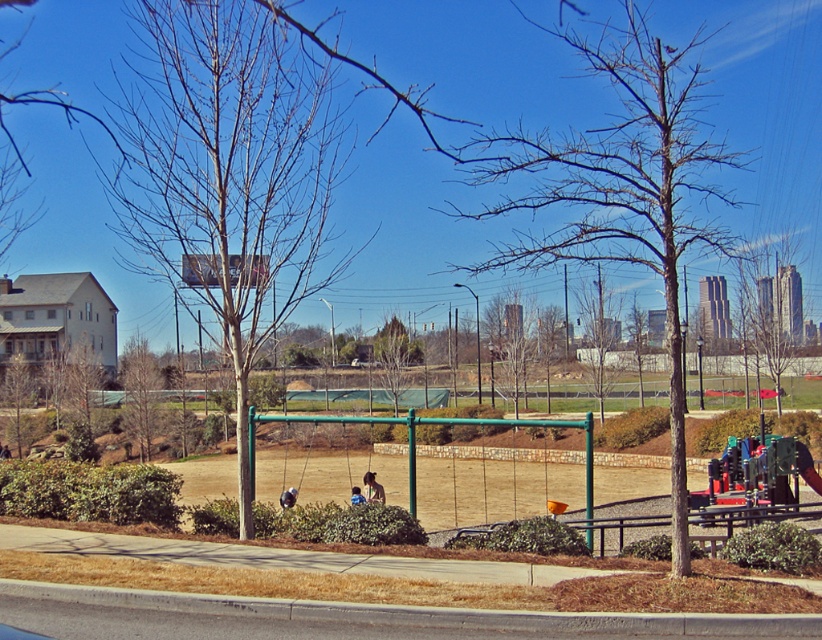
Question: Estimate the real-world distances between objects in this image. Which object is closer to the metallic silver swing at center?

Choices:
 (A) bare wood tree at center
 (B) brown/dry tree at left
 (C) blue denim jeans at lower center
 (D) dark brown leather jacket at lower center

Answer: (C)

Question: Which of the following is the closest to the observer?

Choices:
 (A) (5, 445)
 (B) (363, 499)
 (C) (284, 500)

Answer: (C)

Question: Is brown/dry tree at left smaller than blue denim jeans at lower center?

Choices:
 (A) no
 (B) yes

Answer: (A)

Question: Is brown/dry tree at left further to the viewer compared to metallic silver swing at center?

Choices:
 (A) no
 (B) yes

Answer: (B)

Question: Which point appears closest to the camera in this image?

Choices:
 (A) (368, 496)
 (B) (370, 490)
 (C) (0, 444)
 (D) (358, 493)

Answer: (D)

Question: Is metallic silver swing at center to the left of blue denim jeans at lower center from the viewer's perspective?

Choices:
 (A) yes
 (B) no

Answer: (A)